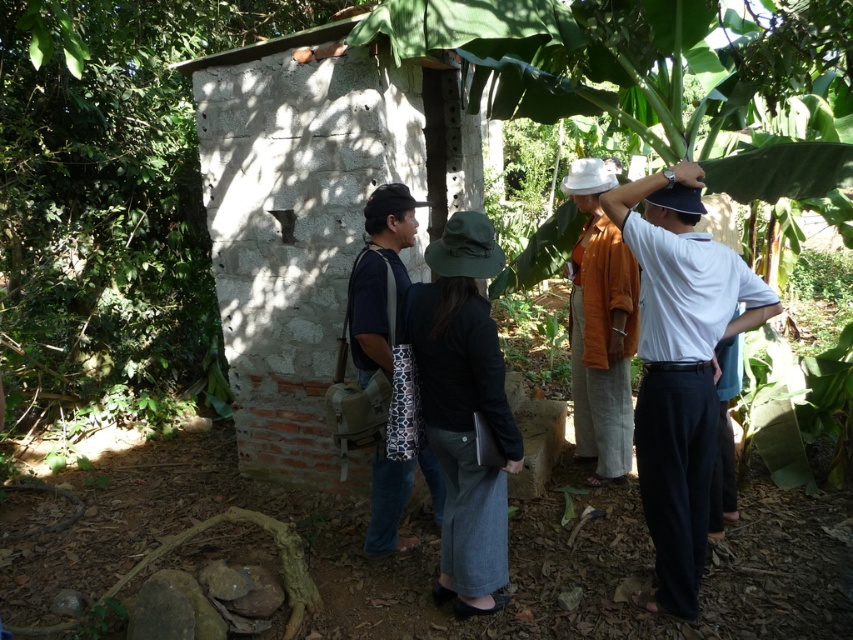
You are a hiker who has just arrived at a rustic structure in a forest. You notice two items at the center of the scene. Which item is taller between the denim skirt at center and the dark blue jeans at center?

The denim skirt at center is taller than the dark blue jeans at center according to the description.

In the scene shown: You are standing at the point marked by the coordinates point [463,410] in the image. What object are you currently standing on?

You are standing on the denim skirt at center as the point [463,410] is on denim skirt at center.

You are a photographer trying to capture a candid shot of the group. Since the white matte shirt at center and dark blue jeans at center are both at the center, which one is closer to the camera lens?

The white matte shirt at center is positioned under dark blue jeans at center, so the dark blue jeans at center is closer to the camera lens because it is above the shirt.